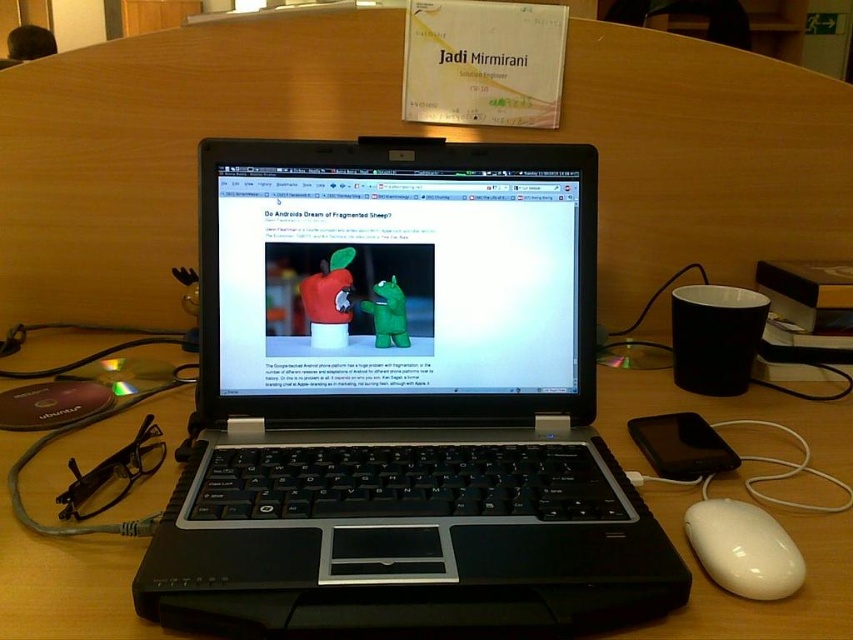
You are setting up a desk for a new employee. The desk has limited space, and you need to place both the black plastic laptop at center and the shiny black laptop at center. Which laptop should you choose to place first to ensure both fit on the desk?

The black plastic laptop at center is bigger than the shiny black laptop at center, so you should place the black plastic laptop at center first to ensure both fit on the desk.

Please provide the coordinates of the black plastic laptop at center in the image coordinate system where the origin is at the bottom left corner of the image. The coordinates should be in the format of a tuple with two decimal numbers rounded to three decimal places.

The coordinates of the black plastic laptop at center are at point (x=399, y=403) in the image coordinate system.